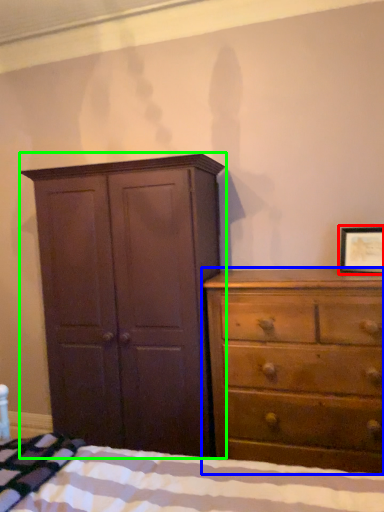
Question: Which object is the closest to the picture frame (highlighted by a red box)? Choose among these: chest of drawers (highlighted by a blue box) or cupboard (highlighted by a green box).

Choices:
 (A) chest of drawers
 (B) cupboard

Answer: (A)